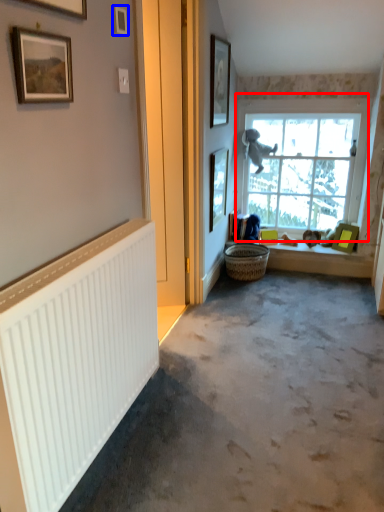
Question: Which of the following is the closest to the observer, window (highlighted by a red box) or picture frame (highlighted by a blue box)?

Choices:
 (A) window
 (B) picture frame

Answer: (B)